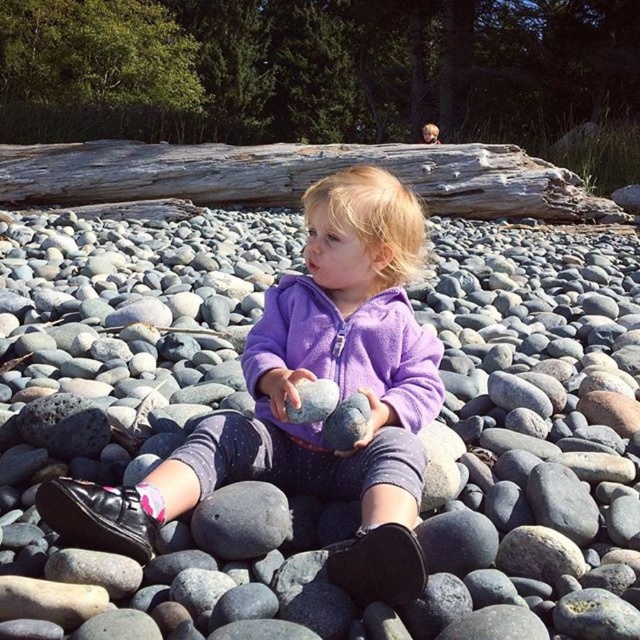
The child is wearing a purple fleece jacket at center and holding a smooth gray rock at center. Which item is taller?

The purple fleece jacket at center is much taller than the smooth gray rock at center.